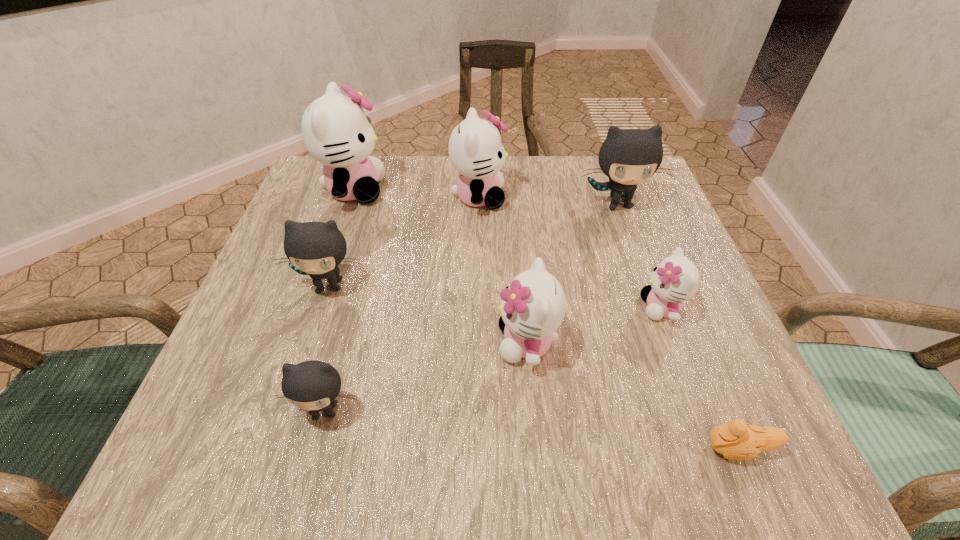
Where is `the tallest object`? The height and width of the screenshot is (540, 960). the tallest object is located at coordinates (336, 132).

At what (x,y) coordinates should I click in order to perform the action: click on the tallest kitten. Please return your answer as a coordinate pair (x, y). The height and width of the screenshot is (540, 960). Looking at the image, I should click on [x=336, y=132].

Identify the location of the third smallest white kitten. (475, 150).

The width and height of the screenshot is (960, 540). In order to click on the farthest gray kitten in this screenshot , I will do `click(628, 157)`.

At what (x,y) coordinates should I click in order to perform the action: click on the biggest gray kitten. Please return your answer as a coordinate pair (x, y). This screenshot has height=540, width=960. Looking at the image, I should click on (628, 157).

Locate an element on the screen. The image size is (960, 540). the third biggest white kitten is located at coordinates (533, 306).

Locate an element on the screen. The height and width of the screenshot is (540, 960). the second biggest gray kitten is located at coordinates (316, 249).

Where is `the rightmost white kitten`? This screenshot has width=960, height=540. the rightmost white kitten is located at coordinates (675, 280).

Where is `the smallest gray kitten`? The height and width of the screenshot is (540, 960). the smallest gray kitten is located at coordinates (313, 385).

Identify the location of the nearest gray kitten. (313, 385).